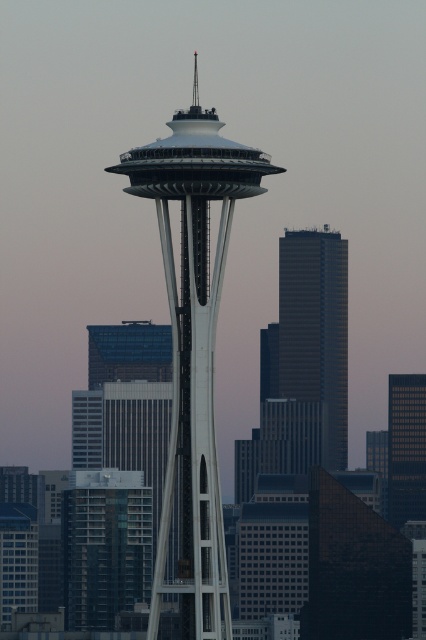
Is dark gray glass skyscraper at center below smooth glass skyscraper at right?

Actually, dark gray glass skyscraper at center is above smooth glass skyscraper at right.

Can you confirm if dark gray glass skyscraper at center is taller than smooth glass skyscraper at right?

Yes.

Identify the location of dark gray glass skyscraper at center. The width and height of the screenshot is (426, 640). (316, 328).

Does point (215, 596) come farther from viewer compared to point (288, 301)?

Yes, it is behind point (288, 301).

Is white glass tower at center thinner than dark gray glass skyscraper at center?

In fact, white glass tower at center might be wider than dark gray glass skyscraper at center.

Is point (167, 189) farther from camera compared to point (345, 376)?

No, (167, 189) is in front of (345, 376).

You are a GUI agent. You are given a task and a screenshot of the screen. Output one action in this format:
    pyautogui.click(x=<x>, y=<y>)
    Task: Click on the white glass tower at center
    The image size is (426, 640).
    Given the screenshot: What is the action you would take?
    (x=193, y=348)

Between point (189, 554) and point (405, 401), which one is positioned behind?

Positioned behind is point (405, 401).

Who is positioned more to the right, white glass tower at center or smooth glass skyscraper at right?

Positioned to the right is smooth glass skyscraper at right.

Describe the element at coordinates (193, 348) in the screenshot. I see `white glass tower at center` at that location.

The image size is (426, 640). What are the coordinates of `white glass tower at center` in the screenshot? It's located at (193, 348).